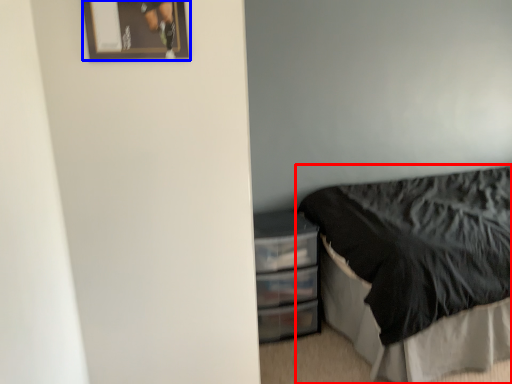
Question: Among these objects, which one is farthest to the camera, bed (highlighted by a red box) or picture frame (highlighted by a blue box)?

Choices:
 (A) bed
 (B) picture frame

Answer: (A)